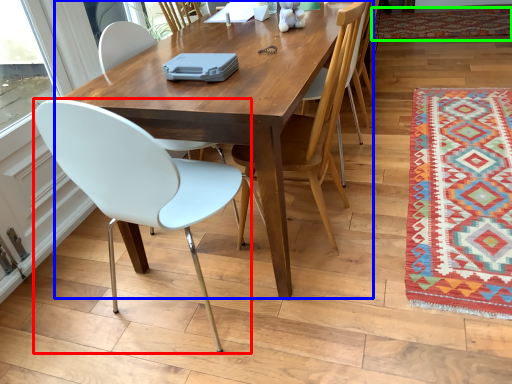
Question: Based on their relative distances, which object is farther from chair (highlighted by a red box)? Choose from kitchen & dining room table (highlighted by a blue box) and mat (highlighted by a green box).

Choices:
 (A) kitchen & dining room table
 (B) mat

Answer: (B)